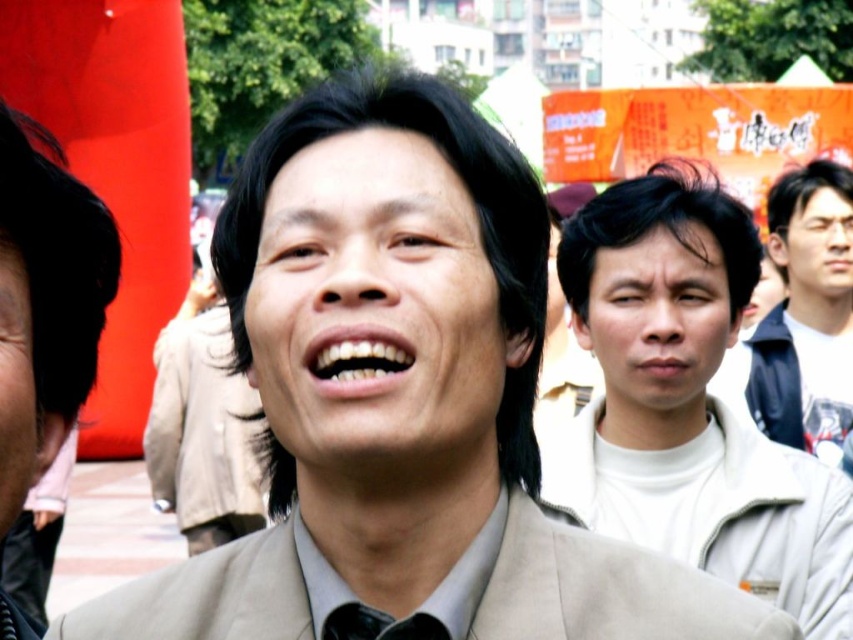
Question: Is light beige suit at center behind smooth skin face at right?

Choices:
 (A) yes
 (B) no

Answer: (B)

Question: Can you confirm if white matte jacket at center is wider than smooth skin face at center?

Choices:
 (A) no
 (B) yes

Answer: (B)

Question: Which of the following is the farthest from the observer?

Choices:
 (A) (403, 364)
 (B) (833, 250)

Answer: (B)

Question: Estimate the real-world distances between objects in this image. Which object is closer to the matte black face at left?

Choices:
 (A) white matte jacket at center
 (B) light brown jacket at center
 (C) smooth beige face at center
 (D) smooth skin face at center

Answer: (C)

Question: Can you confirm if beige fabric business suit at center is wider than smooth skin face at right?

Choices:
 (A) no
 (B) yes

Answer: (B)

Question: Among these points, which one is farthest from the camera?

Choices:
 (A) (807, 342)
 (B) (12, 426)

Answer: (A)